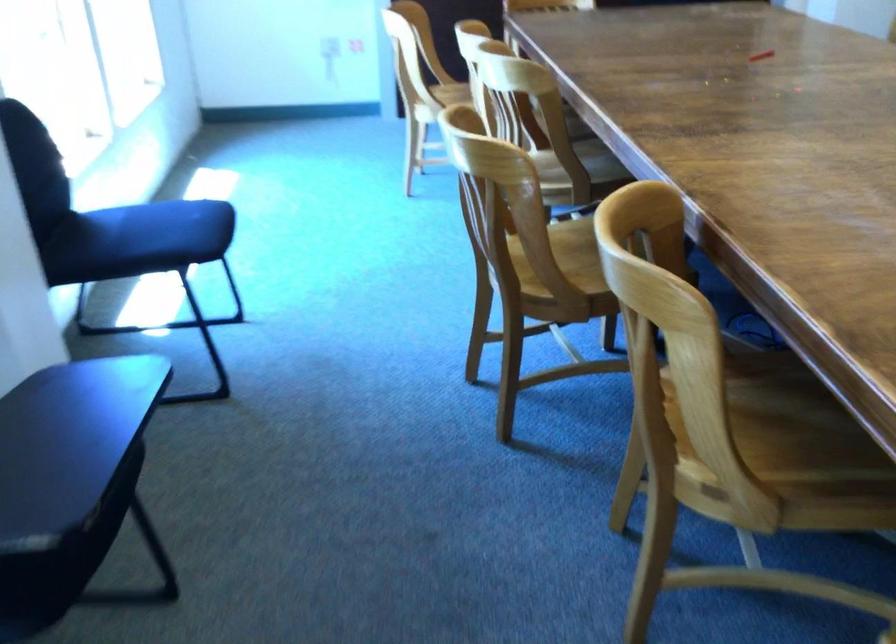
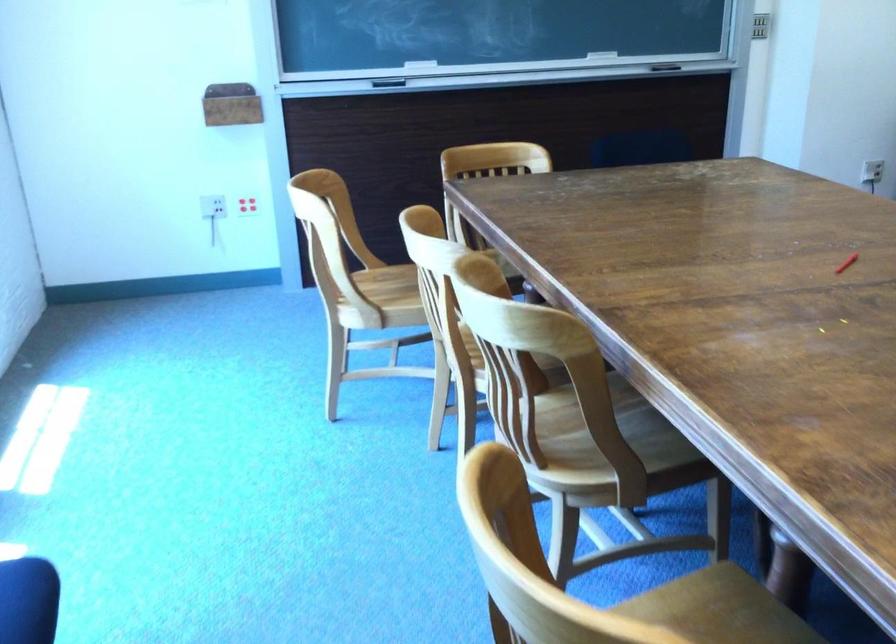
Locate, in the second image, the point that corresponds to pixel 442 93 in the first image.

(393, 286)